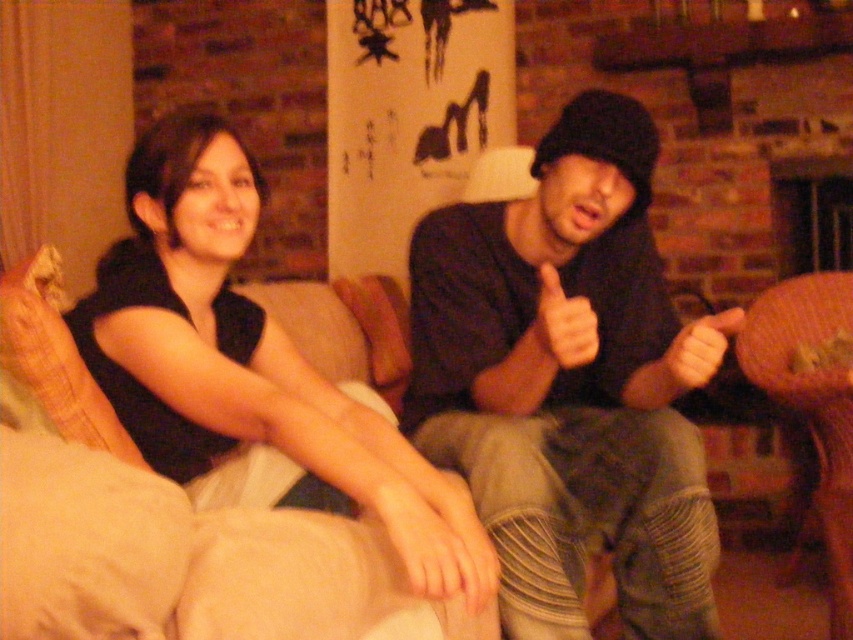
Question: Which point appears farthest from the camera in this image?

Choices:
 (A) (437, 365)
 (B) (236, 440)
 (C) (816, 301)
 (D) (668, 358)

Answer: (C)

Question: Which object is the farthest from the black matte hoodie at upper center?

Choices:
 (A) brown woven armchair at lower right
 (B) matte black hand at center
 (C) dark gray hoodie at center
 (D) smooth skin hand at center

Answer: (A)

Question: Which object is positioned closest to the smooth skin hand at center?

Choices:
 (A) brown woven armchair at lower right
 (B) matte black hand at center
 (C) black matte hoodie at upper center

Answer: (B)

Question: Is black matte hoodie at upper center to the right of dark gray hoodie at center from the viewer's perspective?

Choices:
 (A) yes
 (B) no

Answer: (B)

Question: Is black matte hoodie at upper center thinner than smooth skin hand at center?

Choices:
 (A) yes
 (B) no

Answer: (B)

Question: Does matte black hand at center have a lesser width compared to smooth skin hand at center?

Choices:
 (A) yes
 (B) no

Answer: (B)